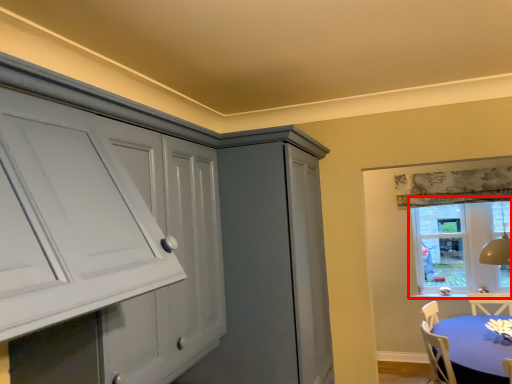
Question: From the image's perspective, where is window (annotated by the red box) located relative to table?

Choices:
 (A) above
 (B) below

Answer: (A)